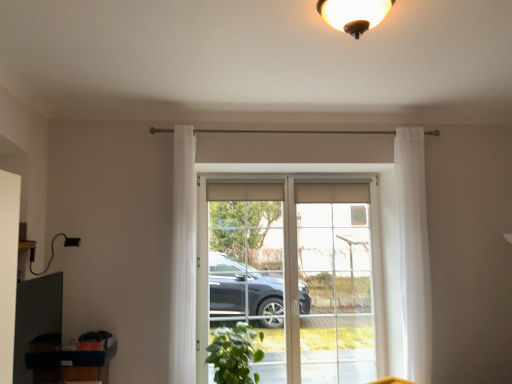
Image resolution: width=512 pixels, height=384 pixels. I want to click on vacant space situated above matte gold light fixture at upper center (from a real-world perspective), so click(351, 7).